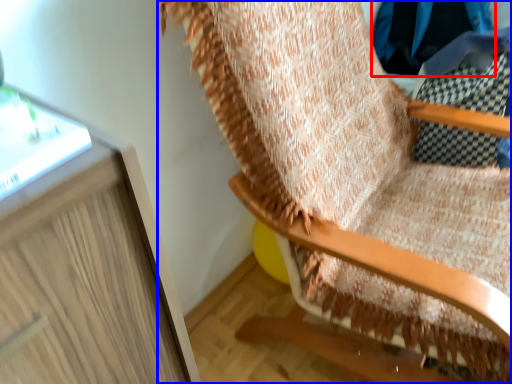
Question: Which object is further to the camera taking this photo, clothing (highlighted by a red box) or furniture (highlighted by a blue box)?

Choices:
 (A) clothing
 (B) furniture

Answer: (A)